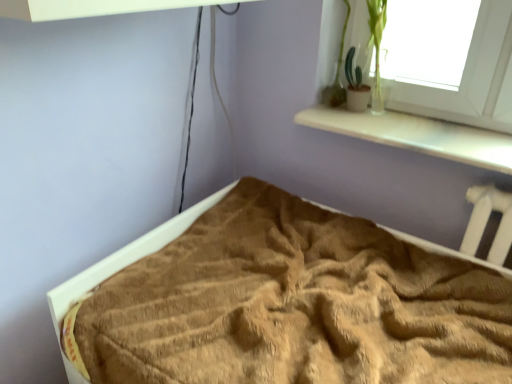
Question: From a real-world perspective, is green matte plant at upper right positioned above or below brown textured blanket at lower center?

Choices:
 (A) below
 (B) above

Answer: (B)

Question: Considering the positions of green matte plant at upper right and brown textured blanket at lower center in the image, is green matte plant at upper right taller or shorter than brown textured blanket at lower center?

Choices:
 (A) short
 (B) tall

Answer: (B)

Question: Do you think green matte plant at upper right is within brown textured blanket at lower center, or outside of it?

Choices:
 (A) outside
 (B) inside

Answer: (A)

Question: In the image, is brown textured blanket at lower center positioned in front of or behind green matte plant at upper right?

Choices:
 (A) behind
 (B) front

Answer: (B)

Question: Is brown textured blanket at lower center taller or shorter than green matte plant at upper right?

Choices:
 (A) tall
 (B) short

Answer: (B)

Question: Considering the relative positions of brown textured blanket at lower center and green matte plant at upper right in the image provided, is brown textured blanket at lower center to the left or to the right of green matte plant at upper right?

Choices:
 (A) right
 (B) left

Answer: (B)

Question: In terms of width, does brown textured blanket at lower center look wider or thinner when compared to green matte plant at upper right?

Choices:
 (A) thin
 (B) wide

Answer: (B)